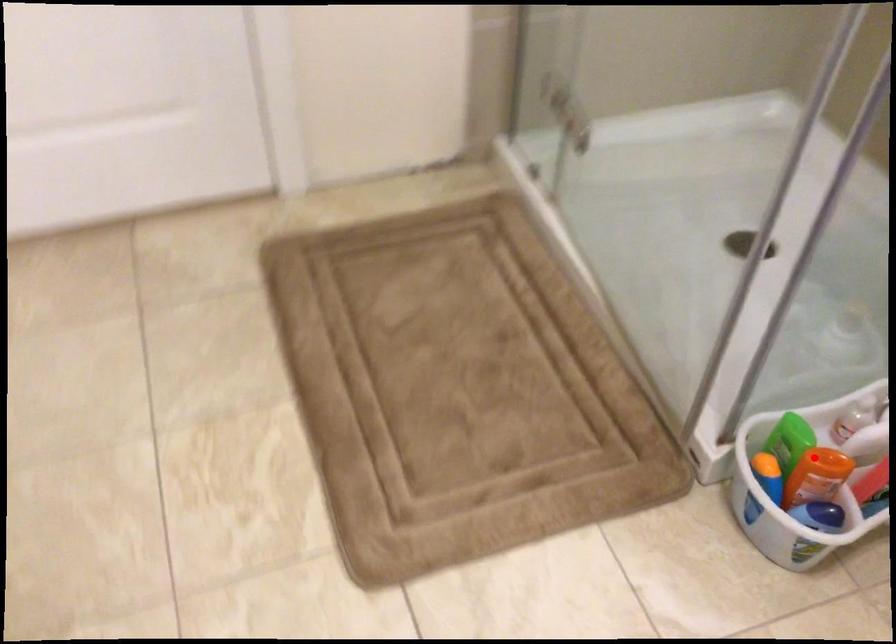
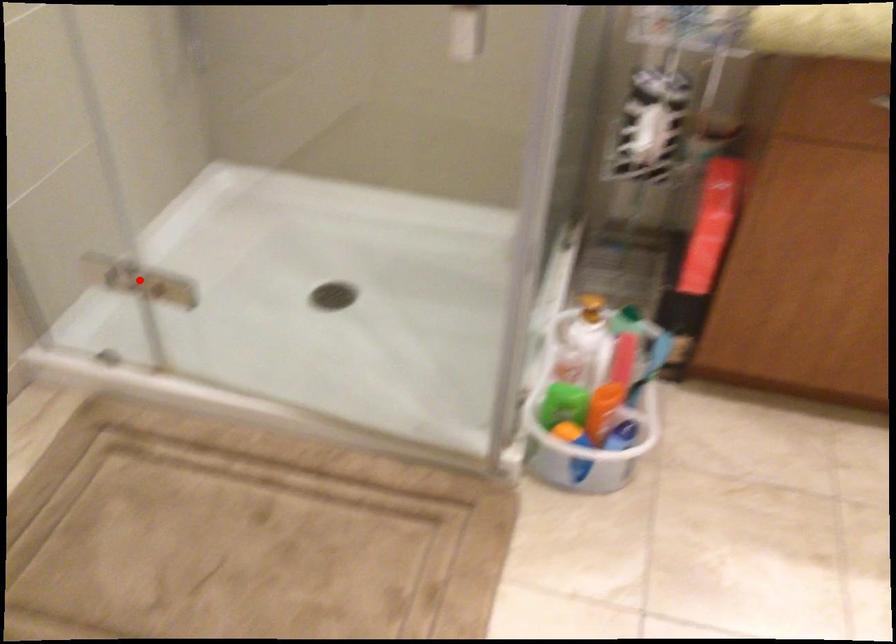
I am providing you with two images of the same scene from different viewpoints. A red point is marked on the first image and another point is marked on the second image. Do the highlighted points in image1 and image2 indicate the same real-world spot?

No